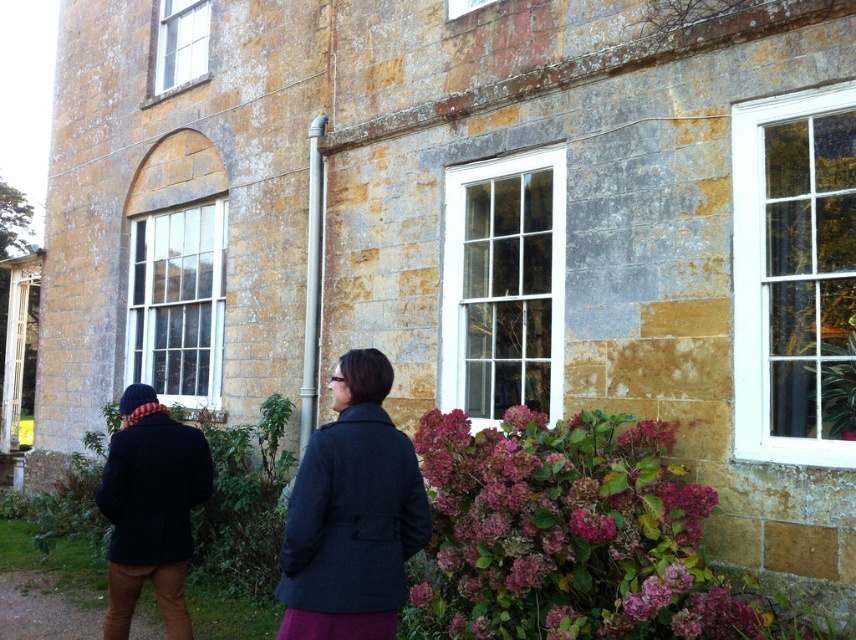
You are standing in front of the building and want to hang a picture frame that is 1.2 meters tall. The frame must be placed above the dark gray wool coat at center. Can the white painted wood window at right accommodate this placement?

The white painted wood window at right is taller than the dark gray wool coat at center. Since the window is taller, there should be enough vertical space above the coat to hang the 1.2 meter tall picture frame without overlapping the window.

You are standing in front of the building and want to take a photo of the white glass window at center without the purple matte hydrangea at lower center blocking it. Which direction should you move to ensure the hydrangea is out of the frame?

Move to the left side of the white glass window at center so that the purple matte hydrangea at lower center, which is on the right side of the window, will be out of the frame.

Looking at this image, you are standing in front of the building and see the white painted wood window at right and the dark gray wool coat at center. Which object is positioned to the right side?

The white painted wood window at right is positioned to the right of the dark gray wool coat at center.